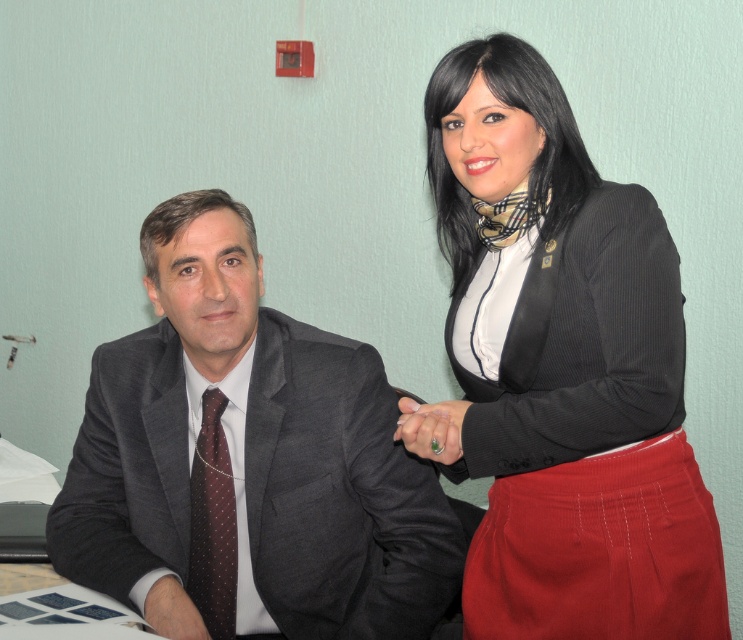
Question: Among these objects, which one is nearest to the camera?

Choices:
 (A) matte black suit at lower left
 (B) brown dotted tie at center

Answer: (A)

Question: Does dark gray suit at left lie in front of green polished ring at center?

Choices:
 (A) yes
 (B) no

Answer: (B)

Question: Which is farther from the brown dotted tie at center?

Choices:
 (A) green polished ring at center
 (B) dark gray suit at left

Answer: (A)

Question: Does brown dotted tie at center appear on the right side of green polished ring at center?

Choices:
 (A) no
 (B) yes

Answer: (A)

Question: Which object is closer to the camera taking this photo?

Choices:
 (A) matte black blazer at upper right
 (B) matte black suit at lower left

Answer: (A)

Question: Does dark gray suit at left have a lesser width compared to brown dotted tie at center?

Choices:
 (A) no
 (B) yes

Answer: (A)